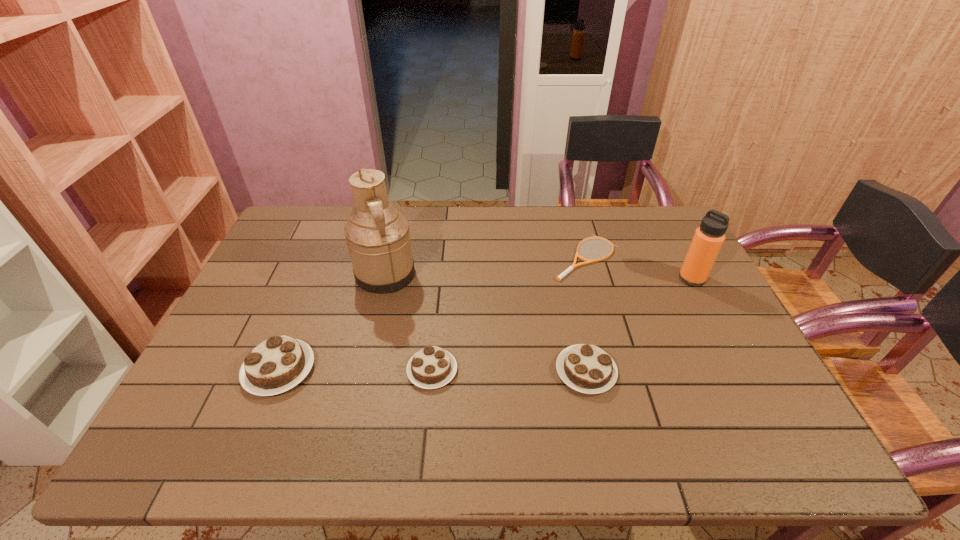
Locate an element on the screen. This screenshot has height=540, width=960. free area in between the second tallest object and the shortest object is located at coordinates (639, 268).

Locate an element on the screen. This screenshot has width=960, height=540. empty space that is in between the second shortest chocolate cake and the pitcher is located at coordinates (486, 323).

Image resolution: width=960 pixels, height=540 pixels. I want to click on vacant area that lies between the shortest chocolate cake and the thermos bottle, so click(562, 325).

The height and width of the screenshot is (540, 960). I want to click on unoccupied position between the second chocolate cake from left to right and the second object from left to right, so click(409, 322).

Locate an element on the screen. This screenshot has width=960, height=540. object that is the second closest to the second chocolate cake from left to right is located at coordinates (279, 363).

Identify the location of the fourth closest object to the second chocolate cake from left to right. (574, 265).

You are a GUI agent. You are given a task and a screenshot of the screen. Output one action in this format:
    pyautogui.click(x=<x>, y=<y>)
    Task: Click on the chocolate cake that can be found as the closest to the tallest object
    This screenshot has width=960, height=540.
    Given the screenshot: What is the action you would take?
    pyautogui.click(x=279, y=363)

Identify which chocolate cake is the second nearest to the second shortest chocolate cake. Please provide its 2D coordinates. Your answer should be formatted as a tuple, i.e. [(x, y)], where the tuple contains the x and y coordinates of a point satisfying the conditions above.

[(279, 363)]

This screenshot has width=960, height=540. I want to click on free spot that satisfies the following two spatial constraints: 1. on the back side of the pitcher; 2. on the left side of the leftmost chocolate cake, so click(318, 274).

Image resolution: width=960 pixels, height=540 pixels. I want to click on free space in the image that satisfies the following two spatial constraints: 1. on the front side of the leftmost chocolate cake; 2. on the left side of the shortest chocolate cake, so click(278, 370).